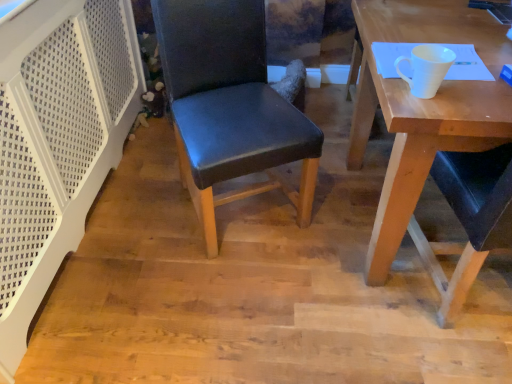
Question: Considering the positions of wooden desk at right and black leather chair at center in the image, is wooden desk at right taller or shorter than black leather chair at center?

Choices:
 (A) short
 (B) tall

Answer: (A)

Question: In the image, is wooden desk at right positioned in front of or behind black leather chair at center?

Choices:
 (A) front
 (B) behind

Answer: (A)

Question: Which object is positioned farthest from the wooden desk at right?

Choices:
 (A) white matte cup at upper right
 (B) black leather chair at center

Answer: (B)

Question: Considering the real-world distances, which object is closest to the wooden desk at right?

Choices:
 (A) white matte cup at upper right
 (B) black leather chair at center

Answer: (A)